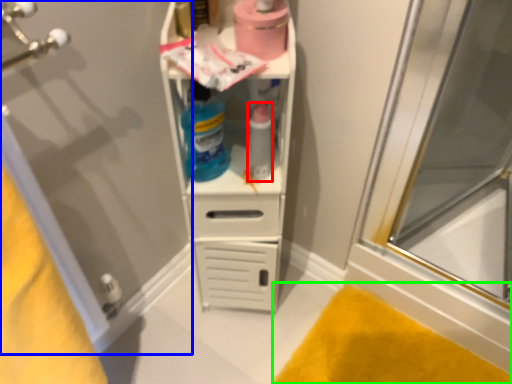
Question: Which object is the farthest from bottle (highlighted by a red box)? Choose among these: screen door (highlighted by a blue box) or bath mat (highlighted by a green box).

Choices:
 (A) screen door
 (B) bath mat

Answer: (B)